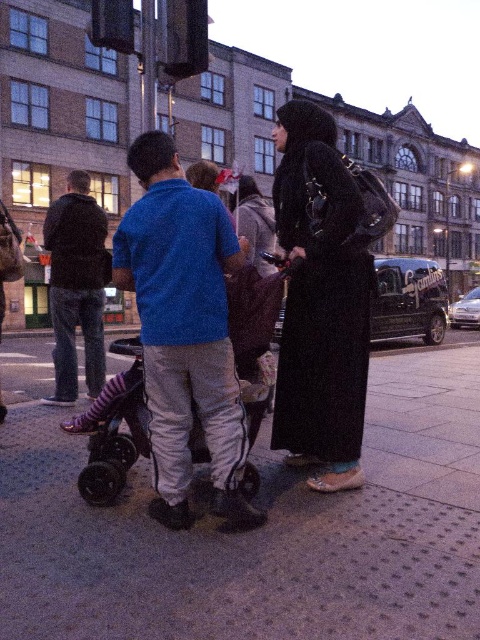
Question: Estimate the real-world distances between objects in this image. Which object is farther from the gray concrete pavement at center?

Choices:
 (A) black matte coat at center
 (B) black rubber baby carriage at center

Answer: (B)

Question: Is black matte coat at center to the right of black rubber baby carriage at center from the viewer's perspective?

Choices:
 (A) yes
 (B) no

Answer: (A)

Question: From the image, what is the correct spatial relationship of gray concrete pavement at center in relation to black matte coat at center?

Choices:
 (A) below
 (B) above

Answer: (A)

Question: Which of the following is the closest to the observer?

Choices:
 (A) (113, 544)
 (B) (345, 176)

Answer: (A)

Question: Does black matte coat at center appear under black rubber baby carriage at center?

Choices:
 (A) no
 (B) yes

Answer: (A)

Question: Which of the following is the closest to the observer?

Choices:
 (A) (107, 451)
 (B) (288, 177)
 (C) (213, 589)

Answer: (C)